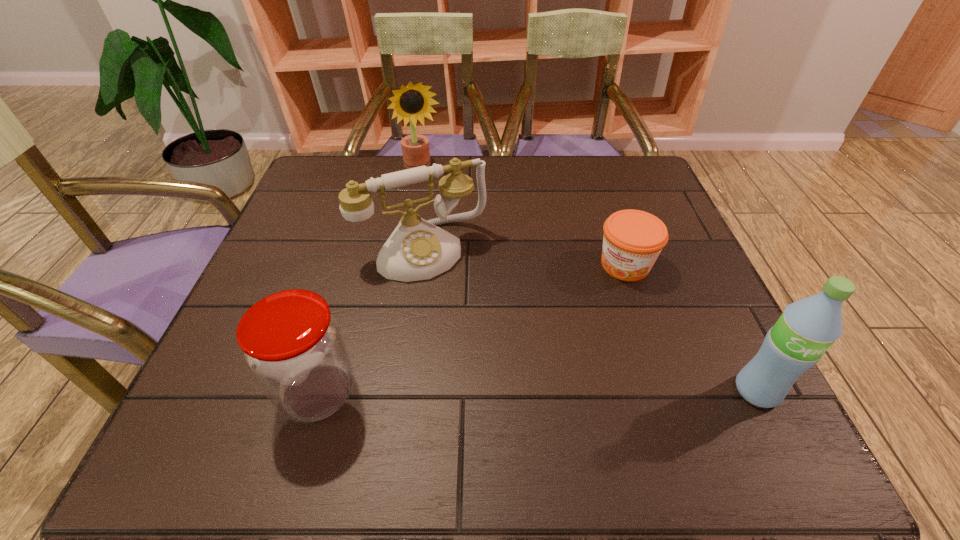
Locate an element on the screen. vacant spot on the desktop that is between the jar and the rightmost object and is positioned on the front label of the jam is located at coordinates (526, 392).

The height and width of the screenshot is (540, 960). In order to click on vacant spot on the desktop that is between the jar and the water bottle and is positioned on the face of the sunflower in this screenshot , I will do `click(489, 392)`.

Identify the location of vacant spot on the desktop that is between the jar and the rightmost object and is positioned on the dial of the telephone. This screenshot has height=540, width=960. (495, 392).